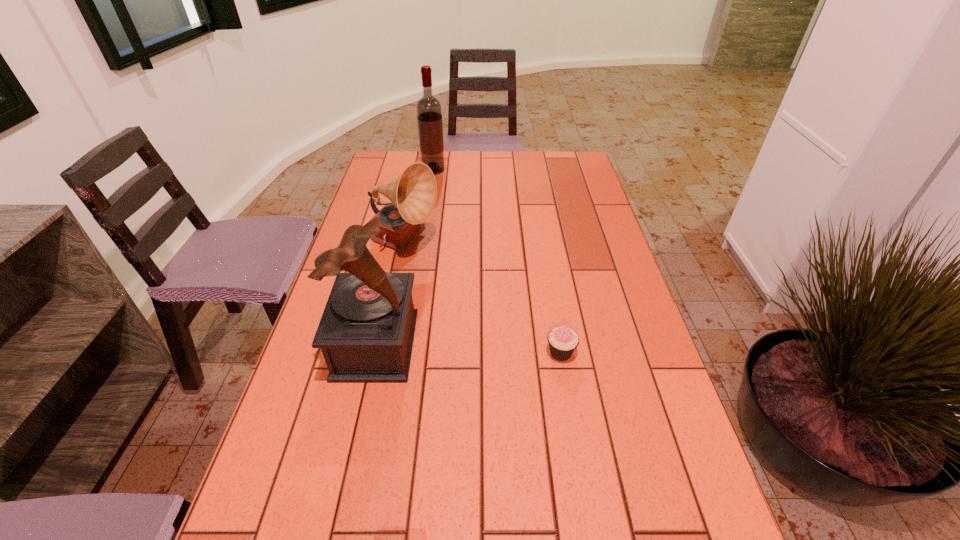
Identify which object is located as the third nearest to the shortest object. Please provide its 2D coordinates. Your answer should be formatted as a tuple, i.e. [(x, y)], where the tuple contains the x and y coordinates of a point satisfying the conditions above.

[(429, 112)]

Find the location of a particular element. This screenshot has height=540, width=960. object that stands as the second closest to the taller phonograph record is located at coordinates (563, 341).

The width and height of the screenshot is (960, 540). Find the location of `vacant space that satisfies the following two spatial constraints: 1. on the horn of the farther phonograph record; 2. on the back side of the shortest object`. vacant space that satisfies the following two spatial constraints: 1. on the horn of the farther phonograph record; 2. on the back side of the shortest object is located at coordinates (383, 353).

You are a GUI agent. You are given a task and a screenshot of the screen. Output one action in this format:
    pyautogui.click(x=<x>, y=<y>)
    Task: Click on the blank area in the image that satisfies the following two spatial constraints: 1. at the horn opening of the taller phonograph record; 2. on the back side of the rightmost object
    The width and height of the screenshot is (960, 540).
    Given the screenshot: What is the action you would take?
    pyautogui.click(x=374, y=353)

I want to click on vacant region that satisfies the following two spatial constraints: 1. on the front side of the farthest object; 2. at the horn opening of the taller phonograph record, so click(406, 345).

Image resolution: width=960 pixels, height=540 pixels. In order to click on vacant area in the image that satisfies the following two spatial constraints: 1. at the horn opening of the taller phonograph record; 2. on the right side of the shortest object in this screenshot , I will do `click(374, 353)`.